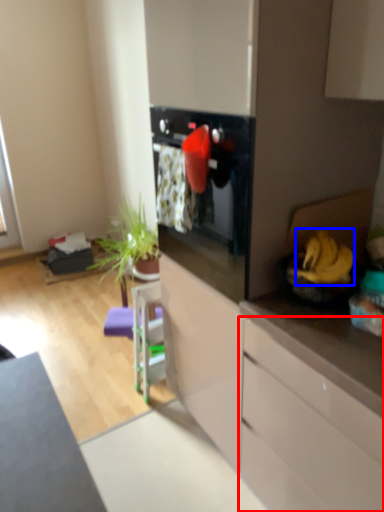
Question: Which object is closer to the camera taking this photo, cabinetry (highlighted by a red box) or banana (highlighted by a blue box)?

Choices:
 (A) cabinetry
 (B) banana

Answer: (A)